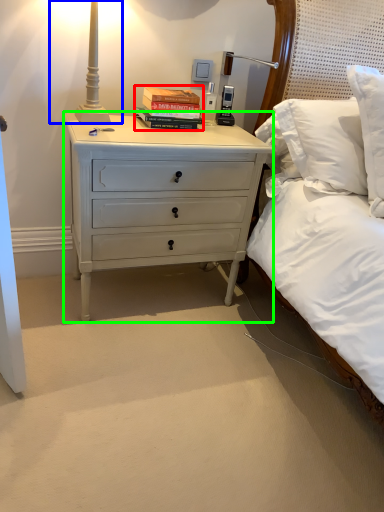
Question: Based on their relative distances, which object is farther from book (highlighted by a red box)? Choose from bedside lamp (highlighted by a blue box) and nightstand (highlighted by a green box).

Choices:
 (A) bedside lamp
 (B) nightstand

Answer: (B)